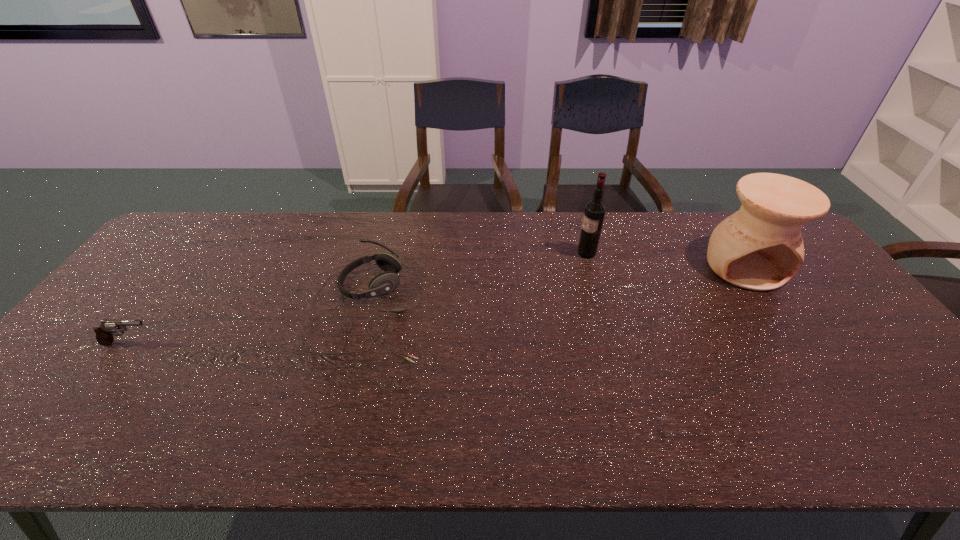
The image size is (960, 540). Find the location of `wine bottle that is at the far edge`. wine bottle that is at the far edge is located at coordinates (595, 210).

Find the location of `pottery located in the far edge section of the desktop`. pottery located in the far edge section of the desktop is located at coordinates click(x=760, y=247).

Find the location of `object that is at the left edge`. object that is at the left edge is located at coordinates (106, 328).

The height and width of the screenshot is (540, 960). In order to click on object present at the right edge in this screenshot , I will do `click(760, 247)`.

This screenshot has width=960, height=540. What are the coordinates of `object positioned at the far right corner` in the screenshot? It's located at (760, 247).

Where is `free space at the far edge`? This screenshot has width=960, height=540. free space at the far edge is located at coordinates (314, 218).

In the image, there is a desktop. Find the location of `vacant space at the right edge`. vacant space at the right edge is located at coordinates (857, 376).

Image resolution: width=960 pixels, height=540 pixels. I want to click on vacant area at the far left corner of the desktop, so click(x=181, y=252).

This screenshot has height=540, width=960. Identify the location of vacant region between the third object from right to left and the wine bottle. (477, 280).

Locate an element on the screen. The width and height of the screenshot is (960, 540). vacant area between the headset and the second object from right to left is located at coordinates (477, 280).